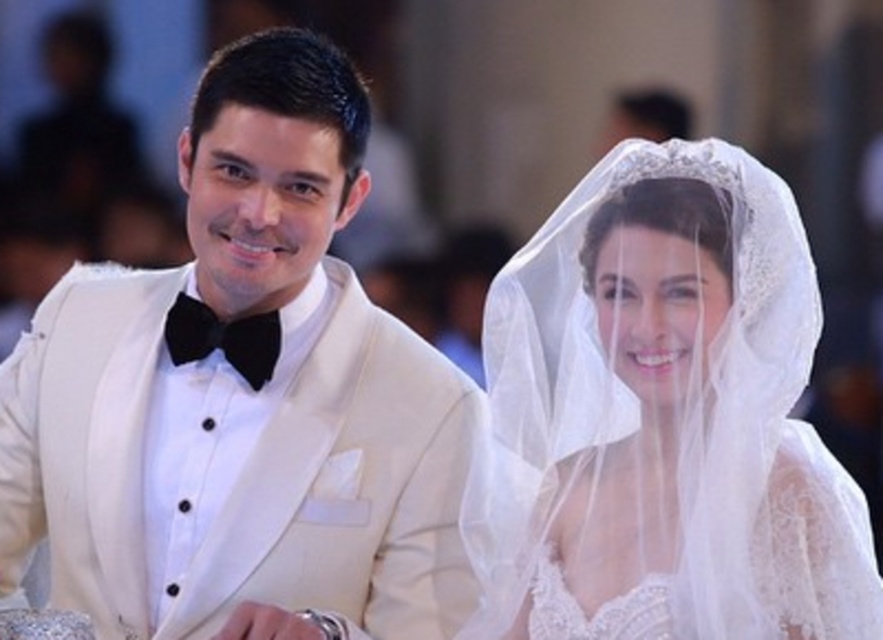
You are a photographer at a wedding. You want to adjust the lighting so that the matte white suit at left is evenly lit. Where should you place the light source relative to the point at coordinates (242, 397)?

The light source should be placed directly above the point at coordinates (242, 397) to ensure even lighting on the matte white suit at left.

You are a photographer at a wedding and need to adjust the lighting to highlight the matte white suit at left. Where should you place the light source relative to the camera to best illuminate the suit?

To best illuminate the matte white suit at left, place the light source at point (242, 397) relative to the camera, as that is where the matte white suit at left is located.